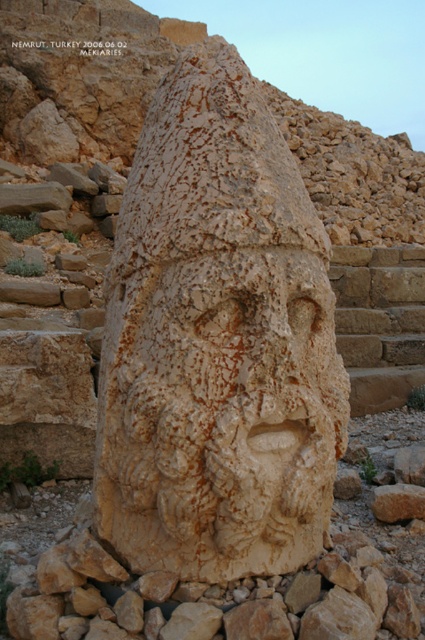
Does brown stone stairs at center appear under black text at upper center?

Indeed, brown stone stairs at center is positioned under black text at upper center.

Between brown stone stairs at center and black text at upper center, which one has more height?

brown stone stairs at center is taller.

This screenshot has height=640, width=425. What do you see at coordinates (379, 323) in the screenshot?
I see `brown stone stairs at center` at bounding box center [379, 323].

Locate an element on the screen. This screenshot has width=425, height=640. brown stone stairs at center is located at coordinates (379, 323).

What do you see at coordinates (217, 340) in the screenshot? This screenshot has height=640, width=425. I see `beige stone sculpture at center` at bounding box center [217, 340].

From the picture: Does beige stone sculpture at center appear under brown stone stairs at center?

Indeed, beige stone sculpture at center is positioned under brown stone stairs at center.

The width and height of the screenshot is (425, 640). What do you see at coordinates (217, 340) in the screenshot?
I see `beige stone sculpture at center` at bounding box center [217, 340].

Find the location of a particular element. beige stone sculpture at center is located at coordinates (217, 340).

Between beige stone sculpture at center and black text at upper center, which one has more height?

With more height is beige stone sculpture at center.

Can you confirm if beige stone sculpture at center is wider than black text at upper center?

No, beige stone sculpture at center is not wider than black text at upper center.

Is point (149, 426) farther from camera compared to point (91, 48)?

No, it is in front of (91, 48).

Where is `beige stone sculpture at center`? The image size is (425, 640). beige stone sculpture at center is located at coordinates (217, 340).